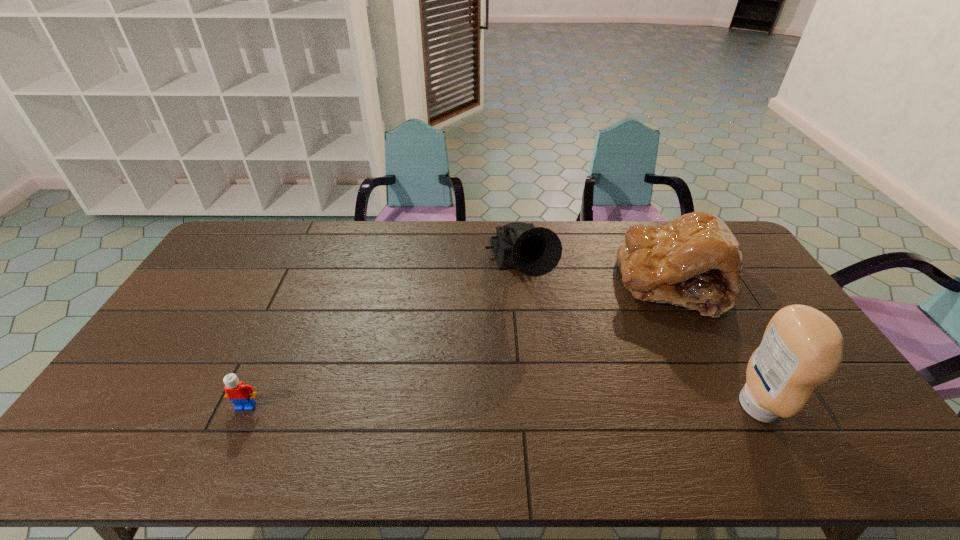
Where is `free space at the near edge of the desktop`? This screenshot has height=540, width=960. free space at the near edge of the desktop is located at coordinates (339, 413).

At what (x,y) coordinates should I click in order to perform the action: click on free space at the left edge. Please return your answer as a coordinate pair (x, y). This screenshot has height=540, width=960. Looking at the image, I should click on (202, 312).

The width and height of the screenshot is (960, 540). Identify the location of free space at the near left corner. (128, 394).

The image size is (960, 540). I want to click on vacant area that lies between the second shortest object and the Lego, so click(459, 345).

What are the coordinates of `free spot between the shortest object and the condiment` in the screenshot? It's located at (502, 406).

Where is `empty space between the third tallest object and the Lego`? The height and width of the screenshot is (540, 960). empty space between the third tallest object and the Lego is located at coordinates (459, 345).

At what (x,y) coordinates should I click in order to perform the action: click on free space between the Lego and the third tallest object. Please return your answer as a coordinate pair (x, y). The height and width of the screenshot is (540, 960). Looking at the image, I should click on (x=459, y=345).

Identify the location of free space between the bread and the condiment. (715, 344).

Locate an element on the screen. The width and height of the screenshot is (960, 540). free area in between the second shortest object and the shortest object is located at coordinates (459, 345).

Where is `vacant space that is in between the leftmost object and the condiment`? Image resolution: width=960 pixels, height=540 pixels. vacant space that is in between the leftmost object and the condiment is located at coordinates (502, 406).